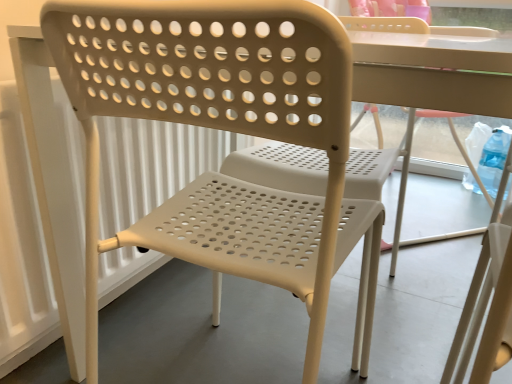
Question: Considering the relative sizes of beige perforated chair at center, placed as the first chair when sorted from back to front, and beige perforated plastic chair at center, placed as the 1th chair when sorted from left to right, in the image provided, is beige perforated chair at center, placed as the first chair when sorted from back to front, shorter than beige perforated plastic chair at center, placed as the 1th chair when sorted from left to right,?

Choices:
 (A) yes
 (B) no

Answer: (B)

Question: From the image's perspective, is beige perforated chair at center, placed as the first chair when sorted from back to front, above beige perforated plastic chair at center, placed as the 1th chair when sorted from left to right?

Choices:
 (A) yes
 (B) no

Answer: (A)

Question: Is beige perforated chair at center, the 1th chair when ordered from right to left, thinner than beige perforated plastic chair at center, which is the 2th chair in back-to-front order?

Choices:
 (A) no
 (B) yes

Answer: (A)

Question: Does beige perforated chair at center, the 1th chair when ordered from right to left, have a greater height compared to beige perforated plastic chair at center, placed as the 1th chair when sorted from left to right?

Choices:
 (A) no
 (B) yes

Answer: (B)

Question: Considering the relative sizes of beige perforated chair at center, the 1th chair when ordered from right to left, and beige perforated plastic chair at center, arranged as the 2th chair when viewed from the right, in the image provided, is beige perforated chair at center, the 1th chair when ordered from right to left, smaller than beige perforated plastic chair at center, arranged as the 2th chair when viewed from the right,?

Choices:
 (A) no
 (B) yes

Answer: (A)

Question: From a real-world perspective, is beige perforated chair at center, the second chair in the front-to-back sequence, located higher than beige perforated plastic chair at center, which is the first chair from front to back?

Choices:
 (A) no
 (B) yes

Answer: (B)

Question: Does beige perforated plastic chair at center, placed as the 1th chair when sorted from left to right, come behind beige perforated chair at center, the second chair in the front-to-back sequence?

Choices:
 (A) no
 (B) yes

Answer: (A)

Question: Would you say beige perforated plastic chair at center, placed as the 1th chair when sorted from left to right, is outside beige perforated chair at center, the 1th chair when ordered from right to left?

Choices:
 (A) no
 (B) yes

Answer: (B)

Question: Considering the relative sizes of beige perforated plastic chair at center, which is the first chair from front to back, and beige perforated chair at center, the second chair in the front-to-back sequence, in the image provided, is beige perforated plastic chair at center, which is the first chair from front to back, shorter than beige perforated chair at center, the second chair in the front-to-back sequence,?

Choices:
 (A) yes
 (B) no

Answer: (A)

Question: Can you see beige perforated plastic chair at center, arranged as the 2th chair when viewed from the right, touching beige perforated chair at center, which ranks as the 2th chair in left-to-right order?

Choices:
 (A) no
 (B) yes

Answer: (A)

Question: Is beige perforated plastic chair at center, which is the 2th chair in back-to-front order, facing away from beige perforated chair at center, the second chair in the front-to-back sequence?

Choices:
 (A) no
 (B) yes

Answer: (A)

Question: Is beige perforated plastic chair at center, arranged as the 2th chair when viewed from the right, far from beige perforated chair at center, placed as the first chair when sorted from back to front?

Choices:
 (A) no
 (B) yes

Answer: (A)

Question: Is beige perforated chair at center, the second chair in the front-to-back sequence, bigger or smaller than beige perforated plastic chair at center, placed as the 1th chair when sorted from left to right?

Choices:
 (A) small
 (B) big

Answer: (B)